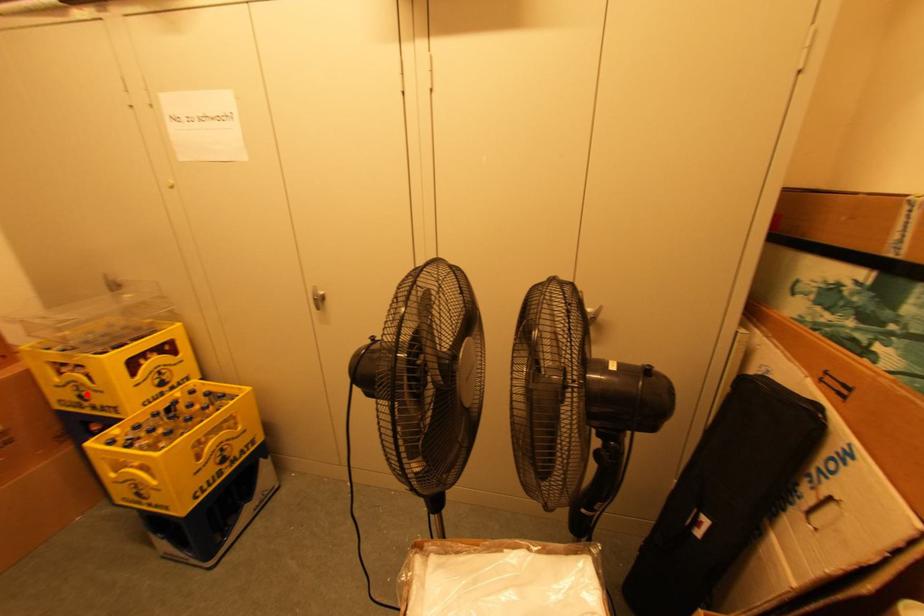
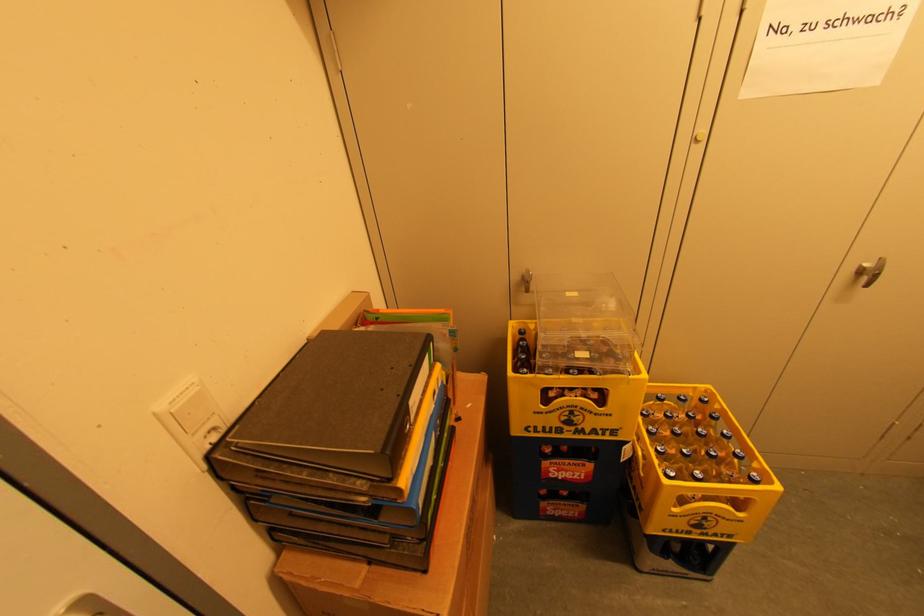
The point at the highlighted location is marked in the first image. Where is the corresponding point in the second image?

(578, 419)